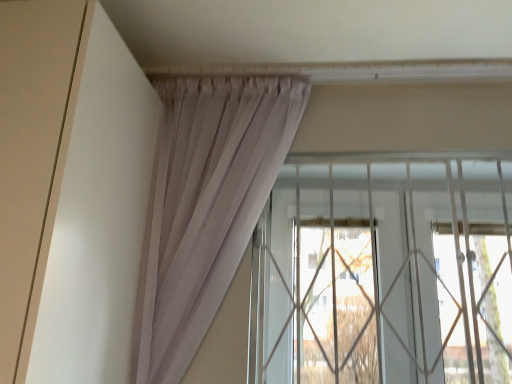
Question: Could you tell me if transparent glass window at center is turned towards white matte door at left?

Choices:
 (A) no
 (B) yes

Answer: (A)

Question: Is transparent glass window at center at the right side of white matte door at left?

Choices:
 (A) no
 (B) yes

Answer: (B)

Question: Can you confirm if transparent glass window at center is smaller than white matte door at left?

Choices:
 (A) yes
 (B) no

Answer: (A)

Question: From a real-world perspective, is transparent glass window at center physically above white matte door at left?

Choices:
 (A) no
 (B) yes

Answer: (A)

Question: Considering the relative sizes of transparent glass window at center and white matte door at left in the image provided, is transparent glass window at center thinner than white matte door at left?

Choices:
 (A) yes
 (B) no

Answer: (A)

Question: Is transparent glass window at center positioned before white matte door at left?

Choices:
 (A) yes
 (B) no

Answer: (B)

Question: Is white matte door at left aimed at transparent glass window at center?

Choices:
 (A) yes
 (B) no

Answer: (B)

Question: From a real-world perspective, is white matte door at left positioned over transparent glass window at center based on gravity?

Choices:
 (A) no
 (B) yes

Answer: (B)

Question: Is the surface of white matte door at left in direct contact with transparent glass window at center?

Choices:
 (A) yes
 (B) no

Answer: (B)

Question: Is white matte door at left taller than transparent glass window at center?

Choices:
 (A) no
 (B) yes

Answer: (B)

Question: From a real-world perspective, does white matte door at left sit lower than transparent glass window at center?

Choices:
 (A) yes
 (B) no

Answer: (B)

Question: Does white matte door at left lie behind transparent glass window at center?

Choices:
 (A) no
 (B) yes

Answer: (A)

Question: From a real-world perspective, relative to transparent glass window at center, is white matte door at left vertically above or below?

Choices:
 (A) below
 (B) above

Answer: (B)